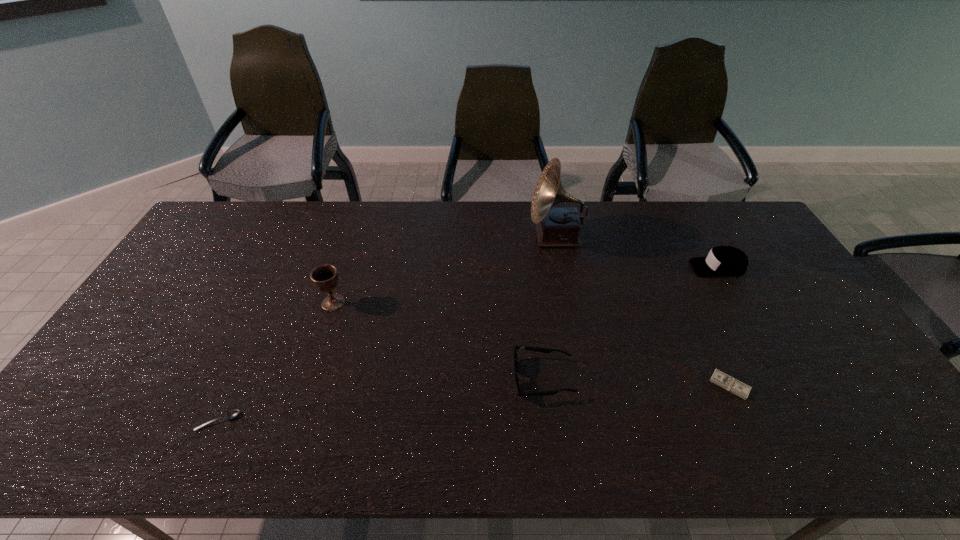
You are a GUI agent. You are given a task and a screenshot of the screen. Output one action in this format:
    pyautogui.click(x=<x>, y=<y>)
    Task: Click on the fifth closest object to the sunglasses
    Image resolution: width=960 pixels, height=540 pixels.
    Given the screenshot: What is the action you would take?
    pyautogui.click(x=233, y=413)

The image size is (960, 540). In order to click on free space that satisfies the following two spatial constraints: 1. on the front-facing side of the fourth shortest object; 2. on the front side of the fifth shortest object in this screenshot , I will do `click(737, 302)`.

Find the location of `free spot that satisfies the following two spatial constraints: 1. on the horn of the second object from right to left; 2. on the left side of the tallest object`. free spot that satisfies the following two spatial constraints: 1. on the horn of the second object from right to left; 2. on the left side of the tallest object is located at coordinates (585, 385).

This screenshot has height=540, width=960. In order to click on vacant area in the image that satisfies the following two spatial constraints: 1. on the horn of the tallest object; 2. on the right side of the fifth object from left to right in this screenshot , I will do `click(585, 385)`.